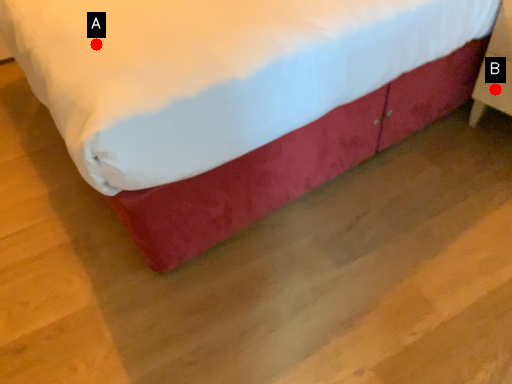
Question: Two points are circled on the image, labeled by A and B beside each circle. Among these points, which one is farthest from the camera?

Choices:
 (A) A is further
 (B) B is further

Answer: (B)